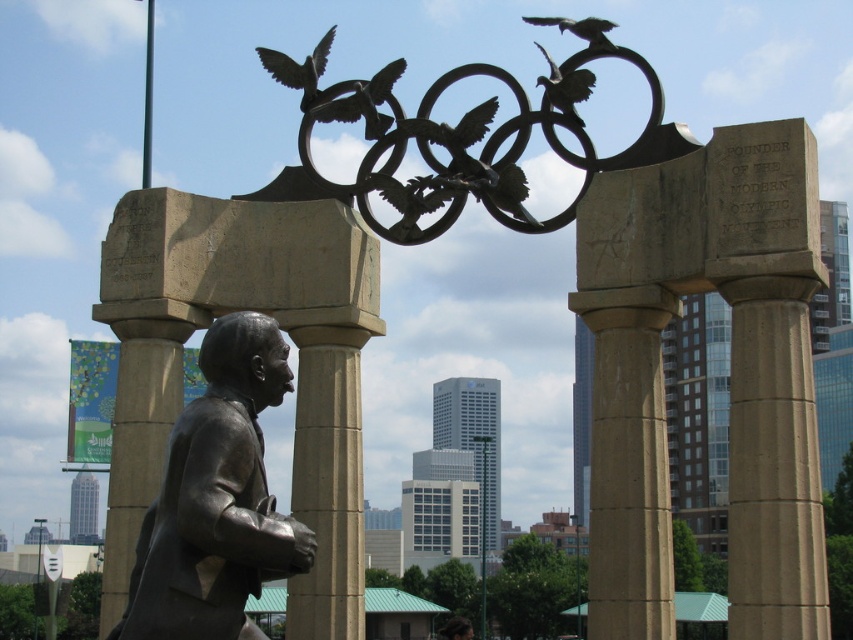
Based on the coordinates provided, which object is located at point (299, 68) in the image?

The point (299, 68) marks the bronze sculpture of bird at upper center.

You are an art student analyzing the monument in the scene. You notice two elements at the upper center of the monument. Which one is smaller in size between the shiny silver bird at upper center and the dark brown feathers at upper center?

The shiny silver bird at upper center is smaller in size compared to the dark brown feathers at upper center.